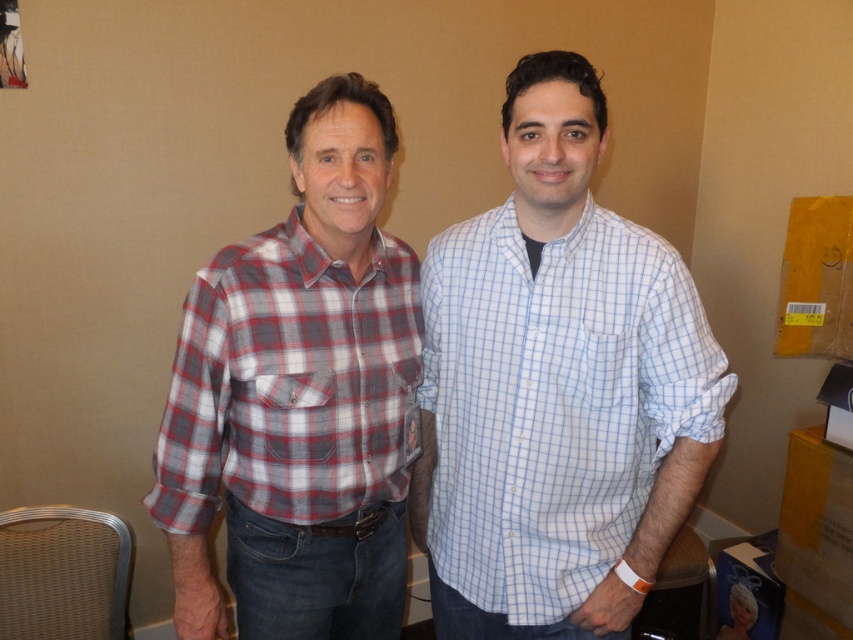
Can you confirm if white checkered shirt at center is bigger than red-gray plaid shirt at left?

Yes.

Looking at this image, measure the distance from white checkered shirt at center to red-gray plaid shirt at left.

white checkered shirt at center is 25.32 centimeters away from red-gray plaid shirt at left.

Where is `white checkered shirt at center`? This screenshot has height=640, width=853. white checkered shirt at center is located at coordinates (556, 388).